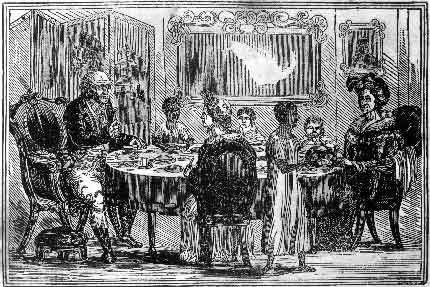
The image size is (430, 287). I want to click on table cloth, so click(150, 187).